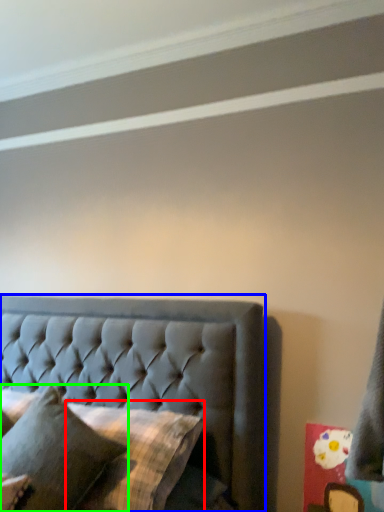
Question: Considering the real-world distances, which object is closest to pillow (highlighted by a red box)? bed (highlighted by a blue box) or pillow (highlighted by a green box).

Choices:
 (A) bed
 (B) pillow

Answer: (B)